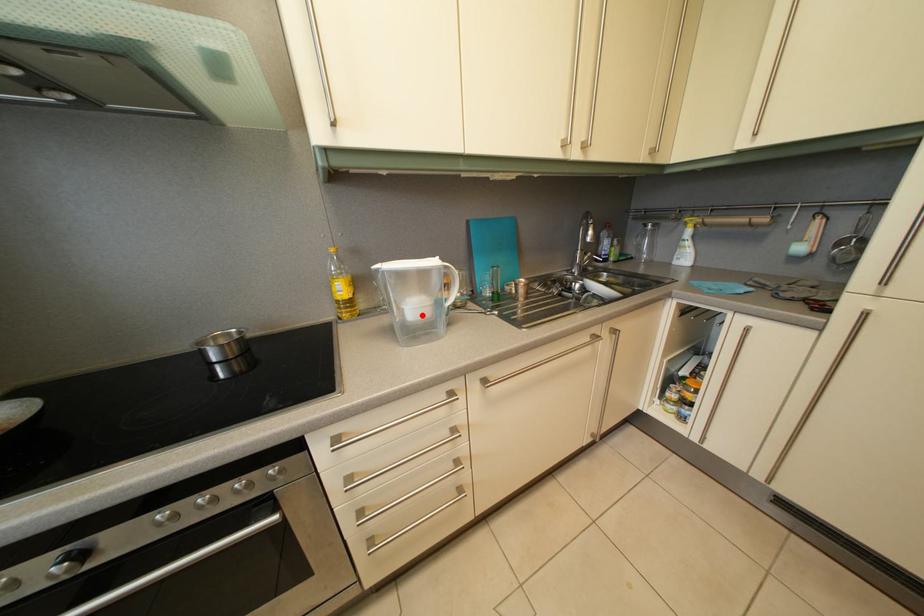
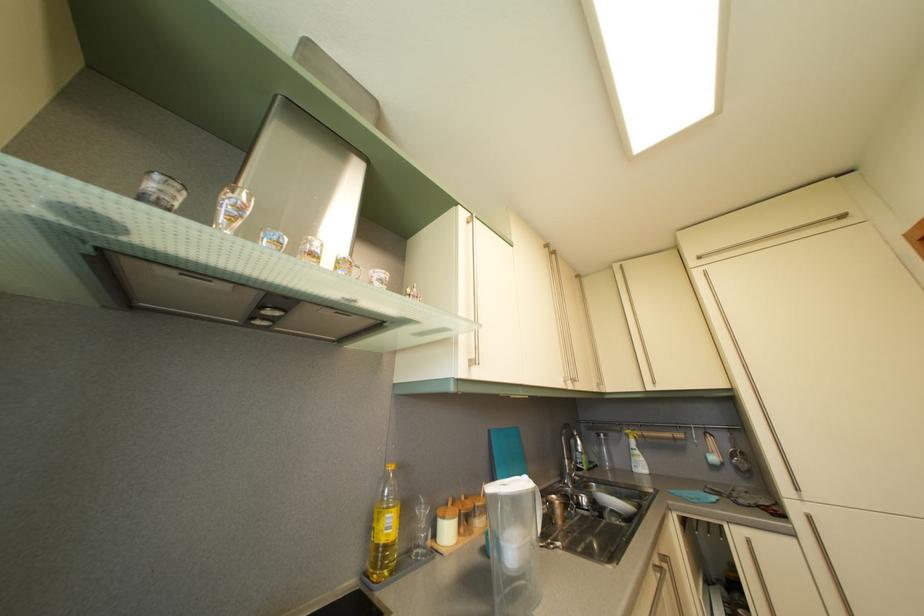
Where in the second image is the point corresponding to the highlighted location from the first image?

(521, 554)